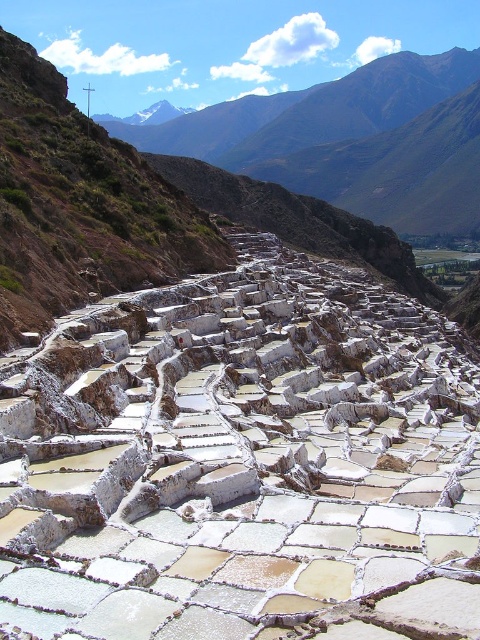
You are a geologist examining the Maras Salt Pans. You observe the white stone at center. Based on its position, can you determine if it is located closer to the top or bottom of the image?

The white stone at center is located at point 0.723 on the x axis and 0.506 on the y axis. Since the y coordinate is 0.506, which is closer to 0.5 than 1, it is near the center vertically. However, since the question is about top or bottom, the y coordinate of 0.506 places it slightly above the midpoint, so it is closer to the bottom of the image.

You are hiking in the Maras Salt Pans area and notice a white stone at center and a rugged brown mountain at upper center. Which object is closer to you as you look at them?

The white stone at center is closer to you because it is in front of the rugged brown mountain at upper center.